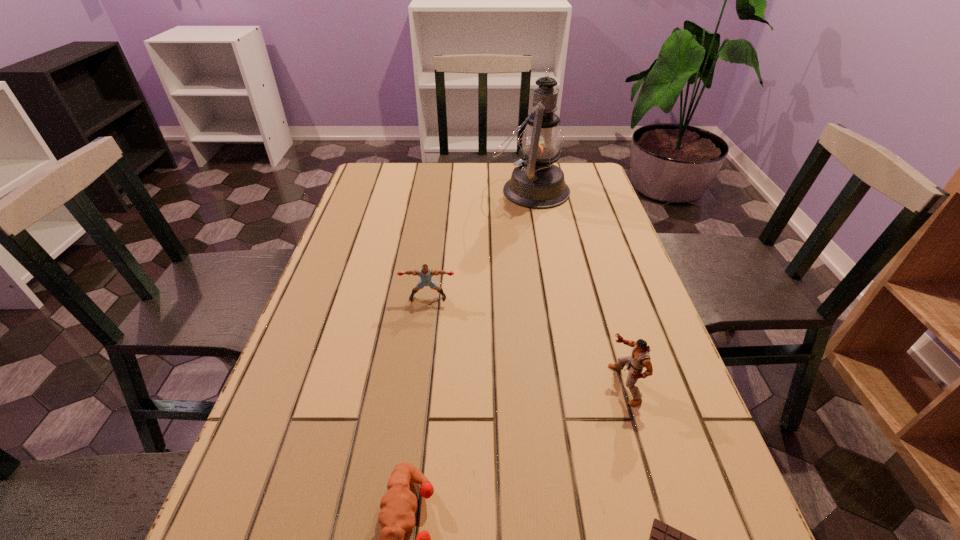
Identify the location of object that is the third closest to the second farthest puncher. The width and height of the screenshot is (960, 540). (425, 273).

Where is `object that is the fourth closest to the chocolate bar`? This screenshot has width=960, height=540. object that is the fourth closest to the chocolate bar is located at coordinates (537, 183).

The image size is (960, 540). I want to click on puncher that is the second closest one to the nearest puncher, so click(x=425, y=273).

Locate an element on the screen. Image resolution: width=960 pixels, height=540 pixels. the second closest puncher to the third nearest object is located at coordinates [425, 273].